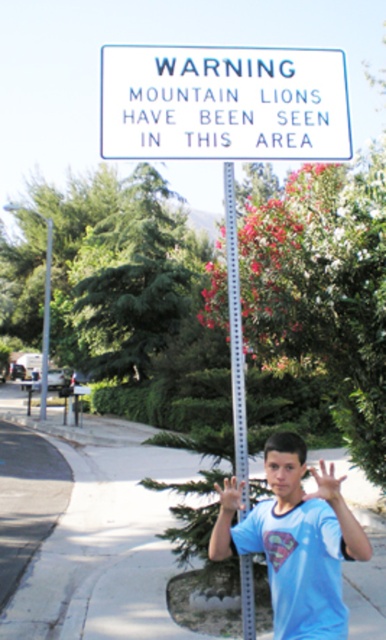
Can you confirm if white plastic sign at upper center is bigger than light blue t-shirt at center?

Indeed, white plastic sign at upper center has a larger size compared to light blue t-shirt at center.

In the scene shown: Is white plastic sign at upper center closer to the viewer compared to light blue t-shirt at center?

No.

Is point (269, 93) closer to camera compared to point (338, 620)?

No, (269, 93) is further to viewer.

At what (x,y) coordinates should I click in order to perform the action: click on white plastic sign at upper center. Please return your answer as a coordinate pair (x, y). Image resolution: width=386 pixels, height=640 pixels. Looking at the image, I should click on (223, 104).

Measure the distance between paved concrete sidewalk at lower center and metallic silver pole at center.

paved concrete sidewalk at lower center and metallic silver pole at center are 25.68 feet apart.

Which is above, paved concrete sidewalk at lower center or metallic silver pole at center?

metallic silver pole at center is higher up.

Is point (89, 540) closer to viewer compared to point (233, 202)?

No, it is behind (233, 202).

At what (x,y) coordinates should I click in order to perform the action: click on paved concrete sidewalk at lower center. Please return your answer as a coordinate pair (x, y). The height and width of the screenshot is (640, 386). Looking at the image, I should click on (101, 538).

What do you see at coordinates (101, 538) in the screenshot?
I see `paved concrete sidewalk at lower center` at bounding box center [101, 538].

Who is positioned more to the left, paved concrete sidewalk at lower center or silver metallic pole at center?

From the viewer's perspective, silver metallic pole at center appears more on the left side.

Where is `paved concrete sidewalk at lower center`? paved concrete sidewalk at lower center is located at coordinates (101, 538).